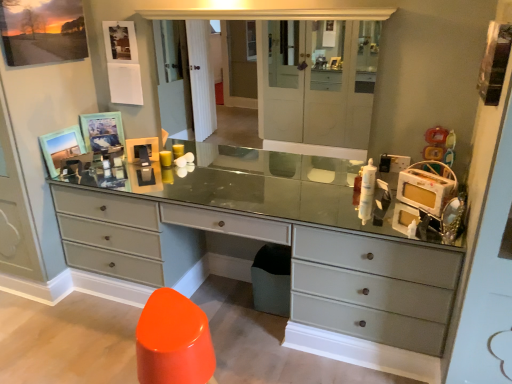
Measure the distance between matte wooden picture frame at upper left, which is counted as the 3th picture frame, starting from the bottom, and camera.

The distance of matte wooden picture frame at upper left, which is counted as the 3th picture frame, starting from the bottom, from camera is 1.93 meters.

What do you see at coordinates (439, 145) in the screenshot?
I see `plastic yellow toy at upper right` at bounding box center [439, 145].

What do you see at coordinates (328, 282) in the screenshot? I see `matte gray dresser at center` at bounding box center [328, 282].

Find the location of a particular element. This screenshot has height=384, width=512. matte wooden picture frame at upper left, which is the first picture frame in top-to-bottom order is located at coordinates (42, 31).

Considering their positions, is matte glass medicine cabinet at center located in front of or behind plastic yellow toy at upper right?

In the image, matte glass medicine cabinet at center appears in front of plastic yellow toy at upper right.

Are matte glass medicine cabinet at center and plastic yellow toy at upper right beside each other?

There is a gap between matte glass medicine cabinet at center and plastic yellow toy at upper right.

Which is more to the left, matte glass medicine cabinet at center or plastic yellow toy at upper right?

matte glass medicine cabinet at center is more to the left.

Can you confirm if matte glass medicine cabinet at center is shorter than plastic yellow toy at upper right?

No, matte glass medicine cabinet at center is not shorter than plastic yellow toy at upper right.

Considering the sizes of objects matte wooden picture frame at upper left, which is the third picture frame from top to bottom, and matte gray dresser at center in the image provided, who is wider, matte wooden picture frame at upper left, which is the third picture frame from top to bottom, or matte gray dresser at center?

matte gray dresser at center.

Which is correct: matte wooden picture frame at upper left, which appears as the 1th picture frame when ordered from the bottom, is inside matte gray dresser at center, or outside of it?

matte wooden picture frame at upper left, which appears as the 1th picture frame when ordered from the bottom, is located beyond the bounds of matte gray dresser at center.

In the scene shown: From the image's perspective, is matte wooden picture frame at upper left, which appears as the 1th picture frame when ordered from the bottom, below matte gray dresser at center?

Incorrect, from the image's perspective, matte wooden picture frame at upper left, which appears as the 1th picture frame when ordered from the bottom, is higher than matte gray dresser at center.

From a real-world perspective, which is physically below, matte wooden picture frame at upper left, which is the third picture frame from top to bottom, or matte gray dresser at center?

From a 3D spatial view, matte gray dresser at center is below.

From the image's perspective, relative to matte wooden picture frame at upper left, which is the third picture frame from top to bottom, is matte gray dresser at center above or below?

Based on their image positions, matte gray dresser at center is located beneath matte wooden picture frame at upper left, which is the third picture frame from top to bottom.

Which is nearer, (x=436, y=290) or (x=56, y=133)?

Clearly, point (x=436, y=290) is closer to the camera than point (x=56, y=133).

Is matte gray dresser at center shorter than matte wooden picture frame at upper left, which appears as the 1th picture frame when ordered from the bottom?

Incorrect, the height of matte gray dresser at center does not fall short of that of matte wooden picture frame at upper left, which appears as the 1th picture frame when ordered from the bottom.

Considering the relative sizes of matte glass medicine cabinet at center and matte wooden picture frame at upper left, which appears as the 1th picture frame when ordered from the bottom, in the image provided, is matte glass medicine cabinet at center bigger than matte wooden picture frame at upper left, which appears as the 1th picture frame when ordered from the bottom,?

Yes.

The image size is (512, 384). In order to click on medicine cabinet to the right of matte wooden picture frame at upper left, which appears as the 1th picture frame when ordered from the bottom in this screenshot , I will do `click(311, 84)`.

Is matte wooden picture frame at upper left, which appears as the 1th picture frame when ordered from the bottom, surrounded by matte glass medicine cabinet at center?

No, matte wooden picture frame at upper left, which appears as the 1th picture frame when ordered from the bottom, is not inside matte glass medicine cabinet at center.

Considering the points (323, 22) and (73, 138), which point is in front, point (323, 22) or point (73, 138)?

Positioned in front is point (323, 22).

Is matte wooden picture frame at upper left, which appears as the 1th picture frame when ordered from the bottom, bigger or smaller than matte glass medicine cabinet at center?

Considering their sizes, matte wooden picture frame at upper left, which appears as the 1th picture frame when ordered from the bottom, takes up less space than matte glass medicine cabinet at center.

Considering the positions of points (61, 161) and (365, 35), is point (61, 161) farther from camera compared to point (365, 35)?

Yes, it is.

Is matte wooden picture frame at upper left, which appears as the 1th picture frame when ordered from the bottom, aimed at matte glass medicine cabinet at center?

Yes.

Identify the location of picture frame that is the 2nd one when counting backward from the matte glass medicine cabinet at center. (61, 148).

From a real-world perspective, does matte glass medicine cabinet at center sit lower than wooden picture frame at upper left, marked as the second picture frame in a bottom-to-top arrangement?

No, from a real-world perspective, matte glass medicine cabinet at center is not below wooden picture frame at upper left, marked as the second picture frame in a bottom-to-top arrangement.

Consider the image. Which object is thinner, matte glass medicine cabinet at center or wooden picture frame at upper left, marked as the second picture frame in a bottom-to-top arrangement?

Thinner between the two is wooden picture frame at upper left, marked as the second picture frame in a bottom-to-top arrangement.

Looking at the image, does matte glass medicine cabinet at center seem bigger or smaller compared to wooden picture frame at upper left, which is the second picture frame from top to bottom?

matte glass medicine cabinet at center is bigger than wooden picture frame at upper left, which is the second picture frame from top to bottom.

Can you confirm if matte glass medicine cabinet at center is shorter than wooden picture frame at upper left, which is the second picture frame from top to bottom?

In fact, matte glass medicine cabinet at center may be taller than wooden picture frame at upper left, which is the second picture frame from top to bottom.

How distant is matte wooden picture frame at upper left, which is the third picture frame from top to bottom, from matte wooden picture frame at upper left, which is the first picture frame in top-to-bottom order?

matte wooden picture frame at upper left, which is the third picture frame from top to bottom, is 20.06 inches from matte wooden picture frame at upper left, which is the first picture frame in top-to-bottom order.

Considering the relative sizes of matte wooden picture frame at upper left, which is the third picture frame from top to bottom, and matte wooden picture frame at upper left, which is counted as the 3th picture frame, starting from the bottom, in the image provided, is matte wooden picture frame at upper left, which is the third picture frame from top to bottom, shorter than matte wooden picture frame at upper left, which is counted as the 3th picture frame, starting from the bottom,?

Yes, matte wooden picture frame at upper left, which is the third picture frame from top to bottom, is shorter than matte wooden picture frame at upper left, which is counted as the 3th picture frame, starting from the bottom.

From a real-world perspective, between matte wooden picture frame at upper left, which appears as the 1th picture frame when ordered from the bottom, and matte wooden picture frame at upper left, which is the first picture frame in top-to-bottom order, who is vertically higher?

A: matte wooden picture frame at upper left, which is the first picture frame in top-to-bottom order, from a real-world perspective.

Where is `the 1st picture frame behind the matte wooden picture frame at upper left, which is the first picture frame in top-to-bottom order`? This screenshot has width=512, height=384. the 1st picture frame behind the matte wooden picture frame at upper left, which is the first picture frame in top-to-bottom order is located at coordinates (61, 148).

Locate an element on the screen. medicine cabinet above the plastic yellow toy at upper right (from the image's perspective) is located at coordinates (311, 84).

Locate an element on the screen. Image resolution: width=512 pixels, height=384 pixels. chest of drawers in front of the matte wooden picture frame at upper left, which appears as the 1th picture frame when ordered from the bottom is located at coordinates (328, 282).

Based on their spatial positions, is wooden picture frame at upper left, marked as the second picture frame in a bottom-to-top arrangement, or plastic yellow toy at upper right closer to matte gray dresser at center?

plastic yellow toy at upper right.

When comparing their distances from matte gray dresser at center, does matte wooden picture frame at upper left, which is the third picture frame from top to bottom, or wooden picture frame at upper left, which is the second picture frame from top to bottom, seem further?

wooden picture frame at upper left, which is the second picture frame from top to bottom.

Consider the image. When comparing their distances from matte glass medicine cabinet at center, does matte wooden picture frame at upper left, which is the first picture frame in top-to-bottom order, or plastic yellow toy at upper right seem further?

matte wooden picture frame at upper left, which is the first picture frame in top-to-bottom order.

Which object lies further to the anchor point plastic yellow toy at upper right, matte wooden picture frame at upper left, which is counted as the 3th picture frame, starting from the bottom, or matte gray dresser at center?

Based on the image, matte wooden picture frame at upper left, which is counted as the 3th picture frame, starting from the bottom, appears to be further to plastic yellow toy at upper right.

Looking at the image, which one is located closer to matte gray dresser at center, plastic yellow toy at upper right or wooden picture frame at upper left, which is the second picture frame from top to bottom?

plastic yellow toy at upper right is closer to matte gray dresser at center.

Based on their spatial positions, is matte gray dresser at center or plastic yellow toy at upper right further from matte glass medicine cabinet at center?

matte gray dresser at center is positioned further to the anchor matte glass medicine cabinet at center.

Based on their spatial positions, is matte wooden picture frame at upper left, which is counted as the 3th picture frame, starting from the bottom, or wooden picture frame at upper left, marked as the second picture frame in a bottom-to-top arrangement, closer to plastic yellow toy at upper right?

The object closer to plastic yellow toy at upper right is wooden picture frame at upper left, marked as the second picture frame in a bottom-to-top arrangement.

Based on their spatial positions, is matte gray dresser at center or wooden picture frame at upper left, which is the second picture frame from top to bottom, further from plastic yellow toy at upper right?

wooden picture frame at upper left, which is the second picture frame from top to bottom, is further to plastic yellow toy at upper right.

You are a GUI agent. You are given a task and a screenshot of the screen. Output one action in this format:
    pyautogui.click(x=<x>, y=<y>)
    Task: Click on the medicine cabinet located between wooden picture frame at upper left, which is the second picture frame from top to bottom, and plastic yellow toy at upper right in the left-right direction
    The height and width of the screenshot is (384, 512).
    Given the screenshot: What is the action you would take?
    click(x=311, y=84)

This screenshot has width=512, height=384. I want to click on picture frame between matte wooden picture frame at upper left, which is the first picture frame in top-to-bottom order, and matte wooden picture frame at upper left, which appears as the 1th picture frame when ordered from the bottom, from top to bottom, so click(x=102, y=131).

Identify the location of medicine cabinet between matte gray dresser at center and plastic yellow toy at upper right. (311, 84).

Identify the location of the chest of drawers situated between wooden picture frame at upper left, marked as the second picture frame in a bottom-to-top arrangement, and matte glass medicine cabinet at center from left to right. (328, 282).